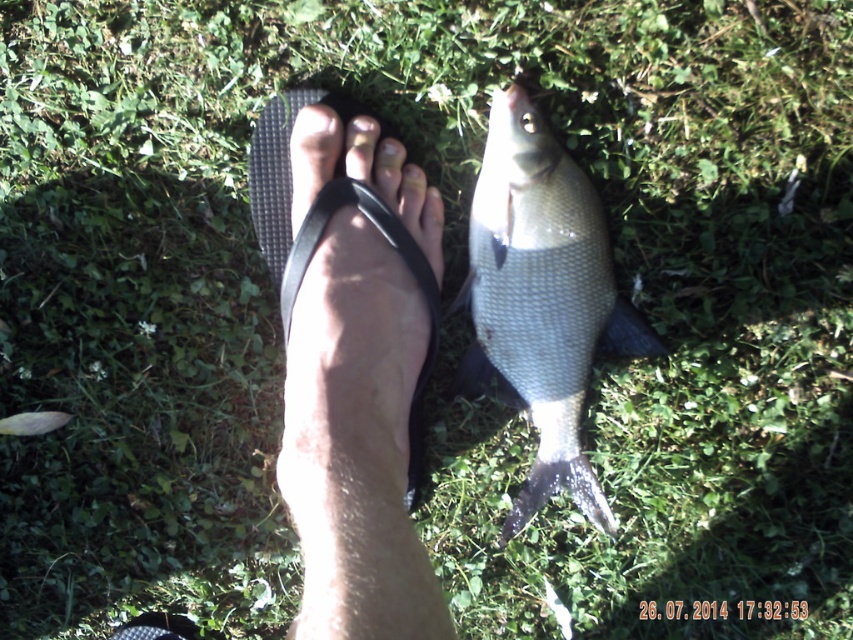
In the scene shown: Is shiny silver fish at center further to the viewer compared to black rubber flip-flop at center?

Yes.

In the scene shown: Can you confirm if shiny silver fish at center is positioned below black rubber flip-flop at center?

Yes.

The height and width of the screenshot is (640, 853). In order to click on shiny silver fish at center in this screenshot , I will do `click(543, 300)`.

I want to click on shiny silver fish at center, so click(x=543, y=300).

Is shiny silver fish at center thinner than matte black toe at center?

No, shiny silver fish at center is not thinner than matte black toe at center.

Between point (523, 304) and point (343, 132), which one is positioned in front?

Point (343, 132) is more forward.

Does point (531, 292) come farther from viewer compared to point (361, 170)?

Yes.

The height and width of the screenshot is (640, 853). In order to click on shiny silver fish at center in this screenshot , I will do `click(543, 300)`.

Does black rubber flip-flop at center have a greater height compared to matte black toe at center?

Yes, black rubber flip-flop at center is taller than matte black toe at center.

Who is positioned more to the right, black rubber flip-flop at center or matte black toe at center?

Positioned to the right is matte black toe at center.

The image size is (853, 640). Identify the location of black rubber flip-flop at center. (323, 230).

Where is `black rubber flip-flop at center`? black rubber flip-flop at center is located at coordinates (323, 230).